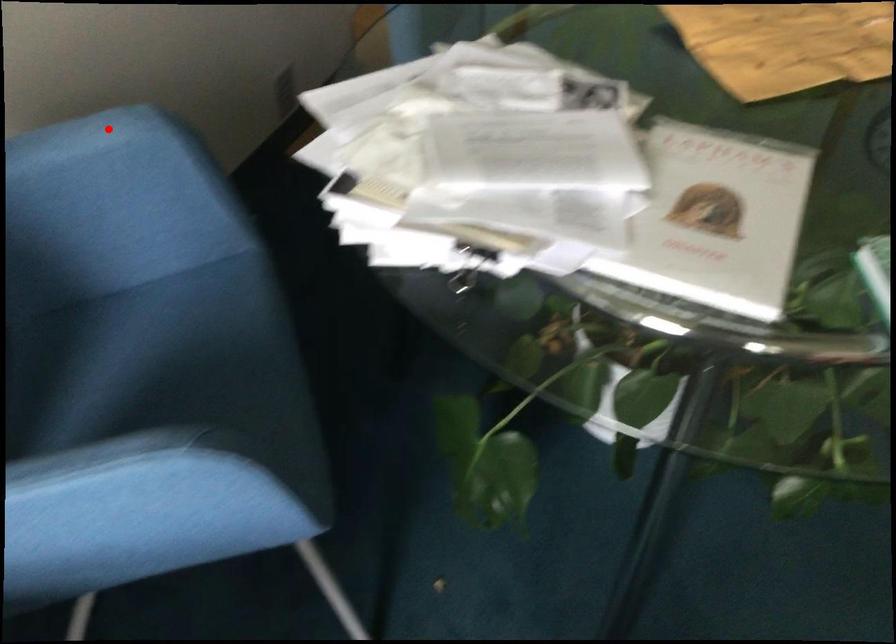
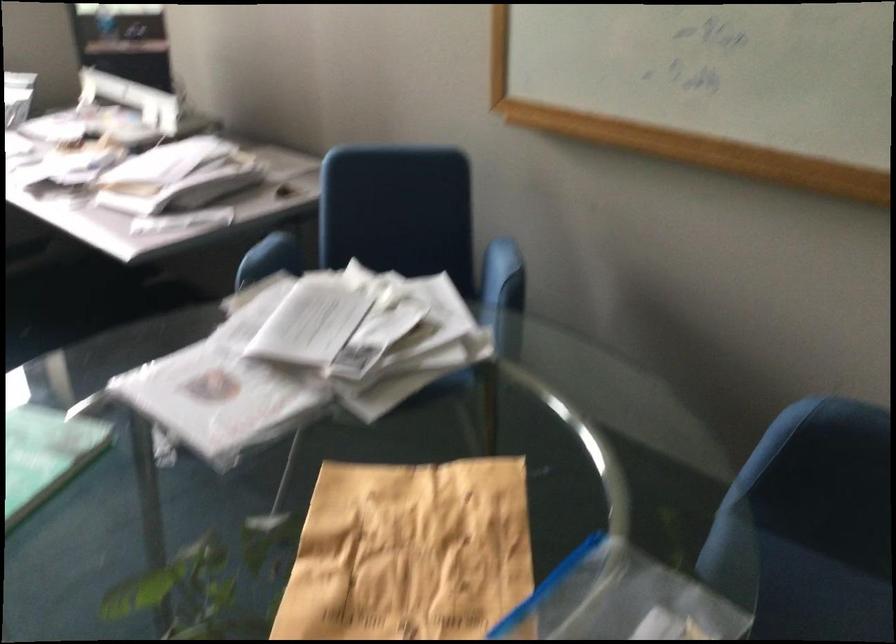
Find the pixel in the second image that matches the highlighted location in the first image.

(498, 265)